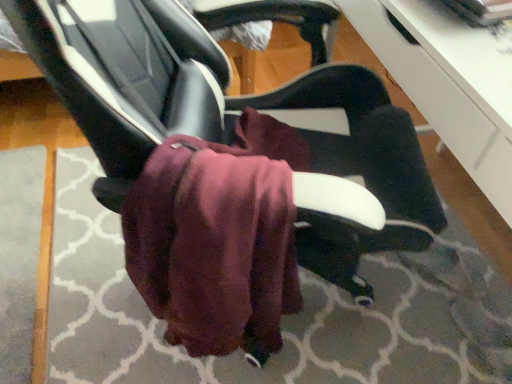
Find the location of a particular element. vacant space situated on the left part of burgundy fleece bath towel at center is located at coordinates (114, 340).